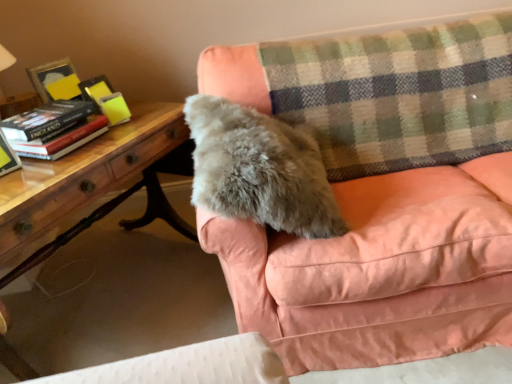
Question: Should I look upward or downward to see wooden table at left?

Choices:
 (A) down
 (B) up

Answer: (A)

Question: From the image's perspective, is hardcover book at left located above soft pink fabric couch at upper right?

Choices:
 (A) yes
 (B) no

Answer: (A)

Question: Is hardcover book at left not inside soft pink fabric couch at upper right?

Choices:
 (A) yes
 (B) no

Answer: (A)

Question: Would you say soft pink fabric couch at upper right is part of hardcover book at left's contents?

Choices:
 (A) yes
 (B) no

Answer: (B)

Question: Does hardcover book at left have a larger size compared to soft pink fabric couch at upper right?

Choices:
 (A) no
 (B) yes

Answer: (A)

Question: Considering the relative sizes of hardcover book at left and soft pink fabric couch at upper right in the image provided, is hardcover book at left shorter than soft pink fabric couch at upper right?

Choices:
 (A) yes
 (B) no

Answer: (A)

Question: From the image's perspective, is hardcover book at left located beneath soft pink fabric couch at upper right?

Choices:
 (A) yes
 (B) no

Answer: (B)

Question: From a real-world perspective, is gray furry pillow at center under hardcover book at left?

Choices:
 (A) no
 (B) yes

Answer: (B)

Question: Is hardcover book at left located within gray furry pillow at center?

Choices:
 (A) no
 (B) yes

Answer: (A)

Question: Is gray furry pillow at center positioned in front of hardcover book at left?

Choices:
 (A) yes
 (B) no

Answer: (A)

Question: Does gray furry pillow at center appear on the left side of hardcover book at left?

Choices:
 (A) no
 (B) yes

Answer: (A)

Question: Does gray furry pillow at center have a lesser width compared to hardcover book at left?

Choices:
 (A) yes
 (B) no

Answer: (B)

Question: From the image's perspective, does gray furry pillow at center appear lower than hardcover book at left?

Choices:
 (A) no
 (B) yes

Answer: (B)

Question: Does hardcover book at left have a smaller size compared to hardcover book at left?

Choices:
 (A) no
 (B) yes

Answer: (A)